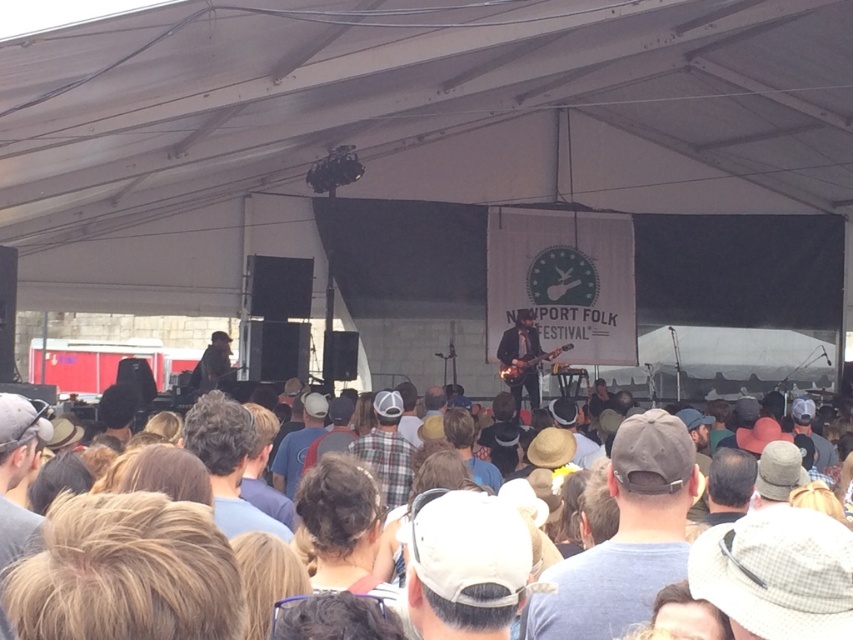
Question: Among these objects, which one is nearest to the camera?

Choices:
 (A) dark brown hair at center
 (B) plaid shirt at center
 (C) gray fabric cap at center

Answer: (C)

Question: Which of the following is the closest to the observer?

Choices:
 (A) gray fabric cap at center
 (B) plaid shirt at center

Answer: (A)

Question: Can you confirm if dark brown hair at center is wider than plaid shirt at center?

Choices:
 (A) yes
 (B) no

Answer: (B)

Question: Can you confirm if dark brown hair at center is bigger than plaid shirt at center?

Choices:
 (A) no
 (B) yes

Answer: (A)

Question: Which point is farther to the camera?

Choices:
 (A) (633, 499)
 (B) (251, 525)

Answer: (B)

Question: Is gray fabric cap at center thinner than plaid shirt at center?

Choices:
 (A) no
 (B) yes

Answer: (A)